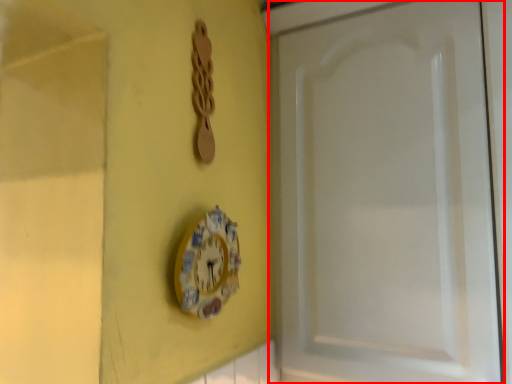
Question: From the image's perspective, considering the relative positions of screen door (annotated by the red box) and wall clock in the image provided, where is screen door (annotated by the red box) located with respect to the staircase?

Choices:
 (A) above
 (B) below

Answer: (A)